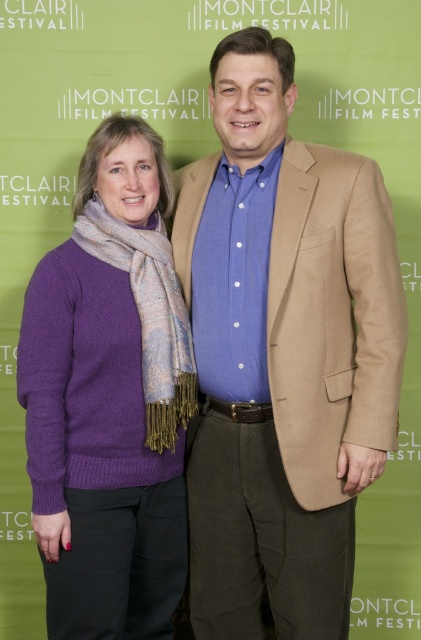
Question: Which point is closer to the camera taking this photo?

Choices:
 (A) (269, 90)
 (B) (47, 634)

Answer: (A)

Question: Does matte beige blazer at center appear on the left side of purple wool sweater at left?

Choices:
 (A) yes
 (B) no

Answer: (B)

Question: Can you confirm if matte beige blazer at center is thinner than purple wool sweater at left?

Choices:
 (A) no
 (B) yes

Answer: (A)

Question: Does matte beige blazer at center appear on the right side of purple wool sweater at left?

Choices:
 (A) yes
 (B) no

Answer: (A)